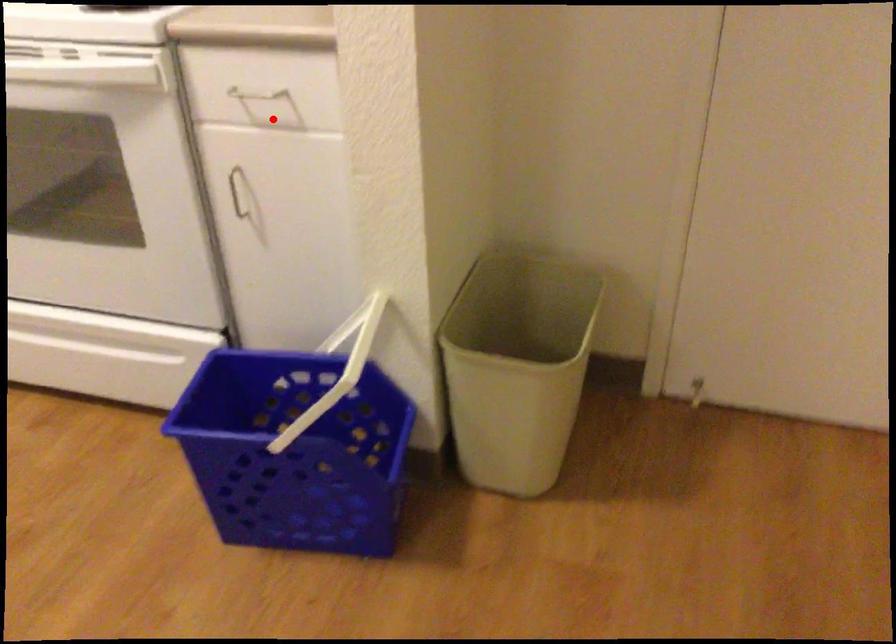
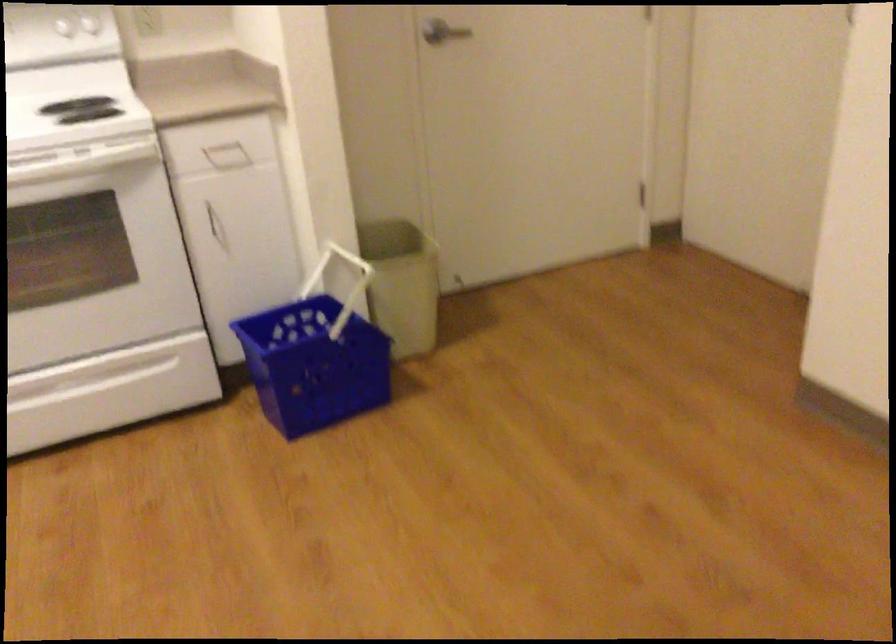
Question: I am providing you with two images of the same scene from different viewpoints. Image1 has a red point marked. In image2, the corresponding 3D location appears at what relative position? Reply with the corresponding letter.

Choices:
 (A) Closer
 (B) Farther

Answer: (B)